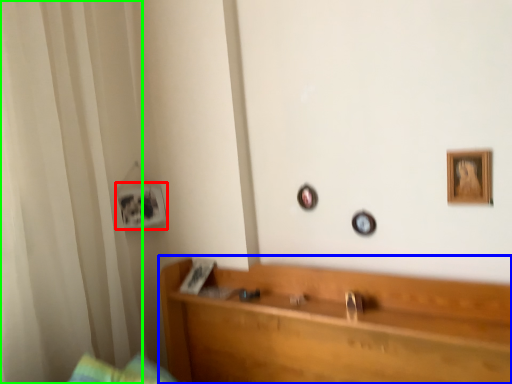
Question: Which object is positioned closest to picture frame (highlighted by a red box)? Select from furniture (highlighted by a blue box) and curtain (highlighted by a green box).

Choices:
 (A) furniture
 (B) curtain

Answer: (B)